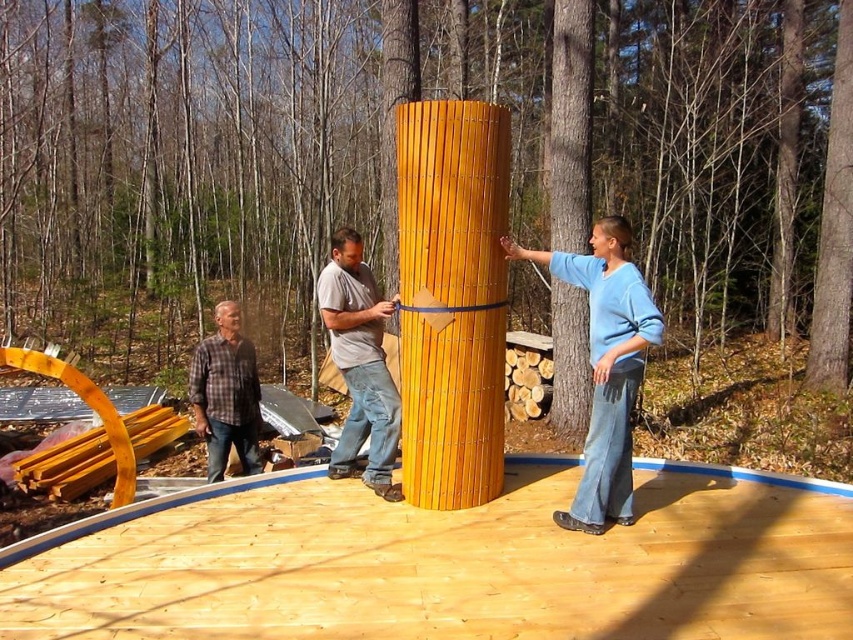
You are a construction worker who needs to place a tool on the smooth bamboo pillar at center. However, you are wearing the matte gray shirt at center. Could your shirt interfere with placing the tool on the pillar?

The smooth bamboo pillar at center might be wider than matte gray shirt at center, so there is a possibility that the shirt could interfere with placing the tool on the pillar if the shirt is wider than the pillar.

You are a fashion designer observing two people in the scene wearing the blue cotton sweater at center and the matte gray shirt at center. Which clothing item has a wider silhouette?

The blue cotton sweater at center has a wider silhouette than the matte gray shirt at center.

You are standing at the center of the circular wooden platform. You need to place a tool exactly at the center of the platform. The smooth bamboo pillar at center is in your way. Can you move the pillar to the edge of the platform so you can place the tool at the true center?

The smooth bamboo pillar at center is already located at the true center of the platform since its position is at point (451,298), which is near the center coordinates. Moving it to the edge would prevent you from accessing the true center. Therefore, you should remove the pillar entirely or find another method to place the tool without disturbing the pillar.